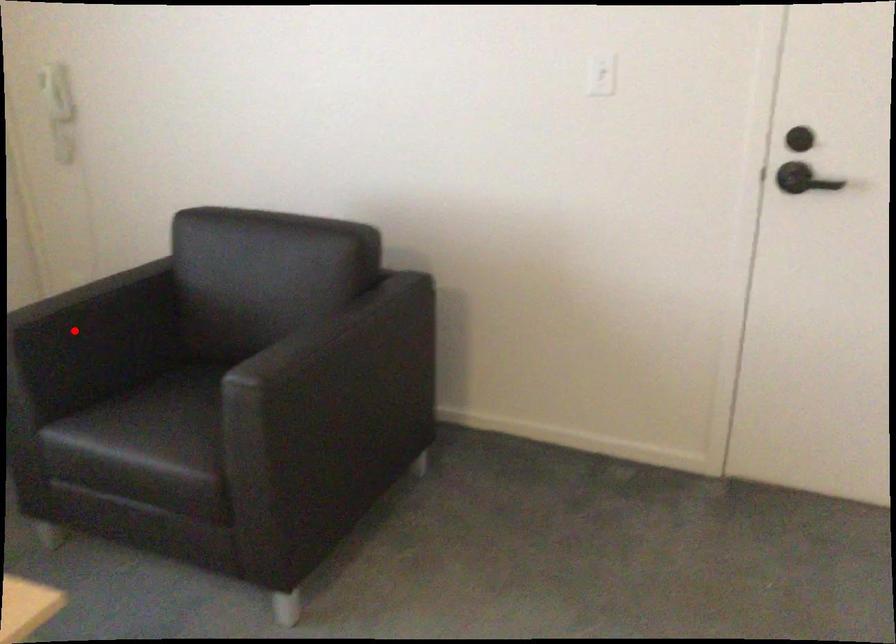
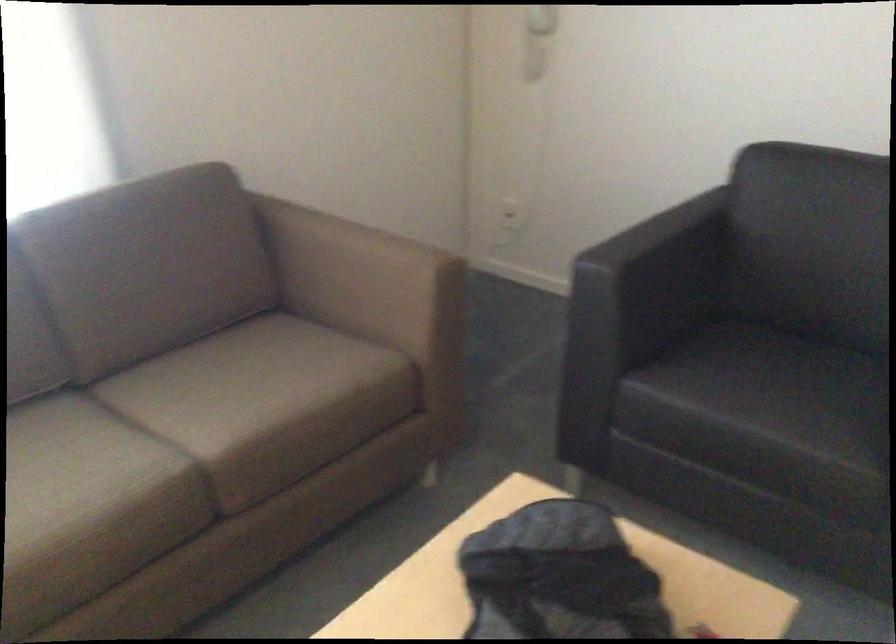
Question: I am providing you with two images of the same scene from different viewpoints. Image1 has a red point marked. In image2, the corresponding 3D location appears at what relative position? Reply with the corresponding letter.

Choices:
 (A) Closer
 (B) Farther

Answer: (A)